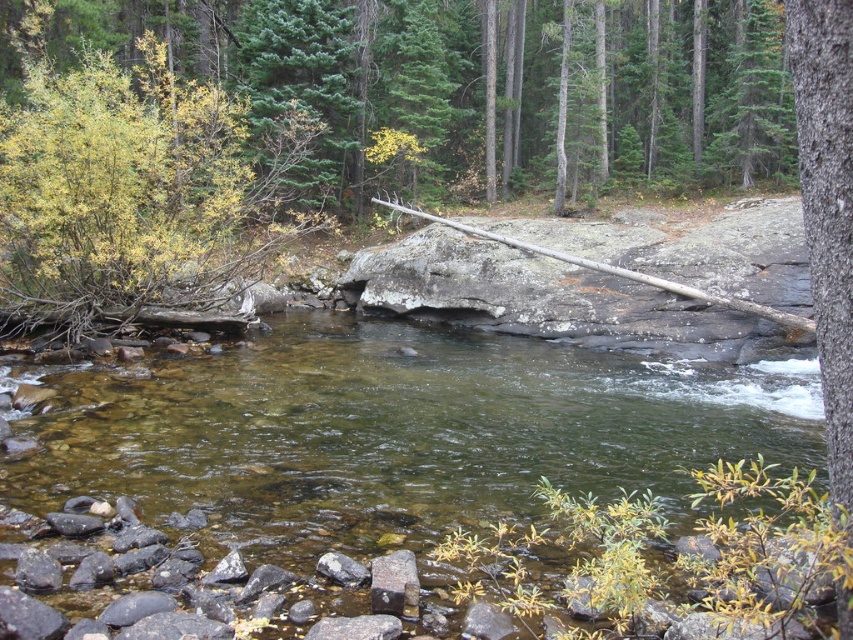
Question: Among these objects, which one is nearest to the camera?

Choices:
 (A) yellow-green foliage at left
 (B) clear water at center

Answer: (B)

Question: Is clear water at center to the left of yellow-green foliage at left from the viewer's perspective?

Choices:
 (A) yes
 (B) no

Answer: (B)

Question: Can you confirm if clear water at center is positioned to the left of yellow-green foliage at left?

Choices:
 (A) yes
 (B) no

Answer: (B)

Question: Can you confirm if clear water at center is positioned below yellow-green foliage at left?

Choices:
 (A) no
 (B) yes

Answer: (B)